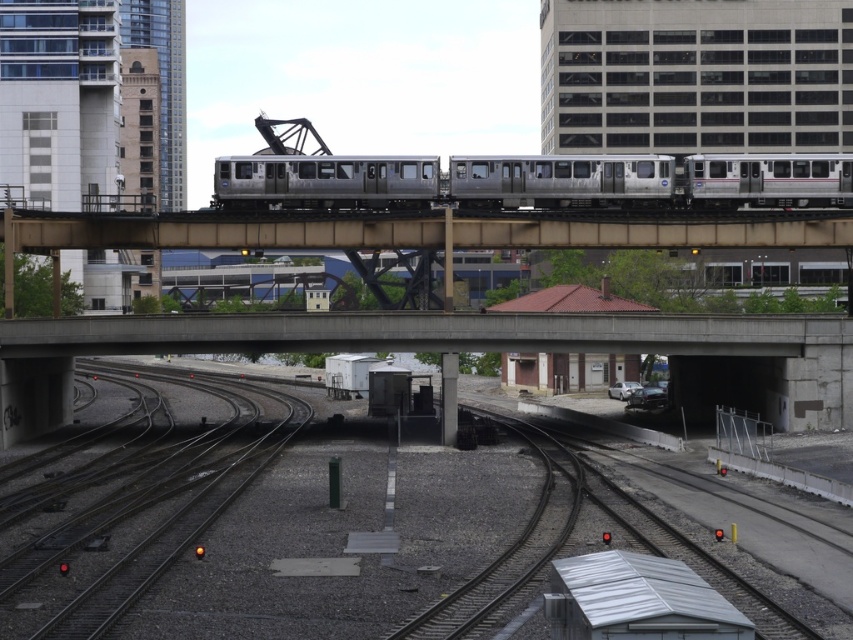
Does dark gray metal tracks at lower left come in front of silver metallic train at center?

Yes, it is in front of silver metallic train at center.

The width and height of the screenshot is (853, 640). In order to click on dark gray metal tracks at lower left in this screenshot , I will do `click(128, 492)`.

Is point (39, 568) less distant than point (672, 168)?

Yes.

I want to click on dark gray metal tracks at lower left, so (128, 492).

Can you confirm if smooth concrete tracks at center is smaller than concrete bridge at center?

Correct, smooth concrete tracks at center occupies less space than concrete bridge at center.

Does smooth concrete tracks at center appear under concrete bridge at center?

Yes.

Is point (300, 458) positioned in front of point (553, 237)?

Yes, it is in front of point (553, 237).

At what (x,y) coordinates should I click in order to perform the action: click on smooth concrete tracks at center. Please return your answer as a coordinate pair (x, y). This screenshot has height=640, width=853. Looking at the image, I should click on (355, 518).

Who is taller, smooth concrete tracks at center or dark gray metal tracks at lower left?

smooth concrete tracks at center is taller.

Can you confirm if smooth concrete tracks at center is bigger than dark gray metal tracks at lower left?

Correct, smooth concrete tracks at center is larger in size than dark gray metal tracks at lower left.

Locate an element on the screen. This screenshot has width=853, height=640. smooth concrete tracks at center is located at coordinates (355, 518).

You are a GUI agent. You are given a task and a screenshot of the screen. Output one action in this format:
    pyautogui.click(x=<x>, y=<y>)
    Task: Click on the smooth concrete tracks at center
    The width and height of the screenshot is (853, 640).
    Given the screenshot: What is the action you would take?
    point(355,518)